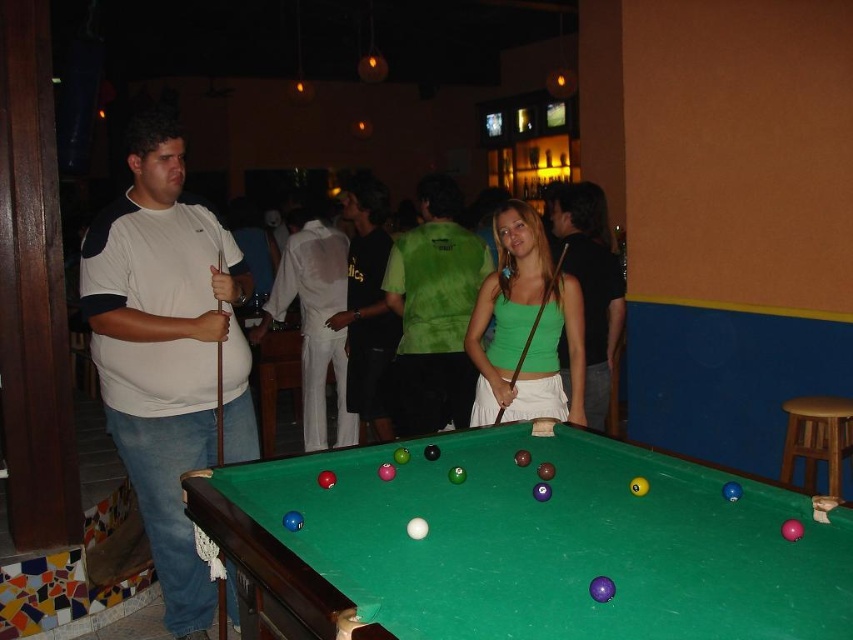
You are a person standing at the entrance of the bar. You want to go to the brown wooden stool at right. Which direction should you walk relative to the green felt billiard table at center?

The green felt billiard table at center is located below the brown wooden stool at right, so you should walk upwards towards the brown wooden stool at right relative to the green felt billiard table at center.

You are a bartender who needs to place a drink on the brown wooden stool at right without it falling. Considering the white satin shirt at center is currently above it, is there enough space?

The white satin shirt at center is located above the brown wooden stool at right, so placing a drink there might cause it to fall unless the shirt is moved.

You are a delivery robot with a 1.5 meter long package. You need to move from the entrance to the bar area where the pool table is located. There is a white satin shirt at center and a brown wooden stool at right in your path. Can you navigate through the space between them without dropping the package?

The distance between the white satin shirt at center and the brown wooden stool at right is 2.64 meters. Since your package is 1.5 meters long, you can safely navigate through the space between them as the distance is wider than the package.